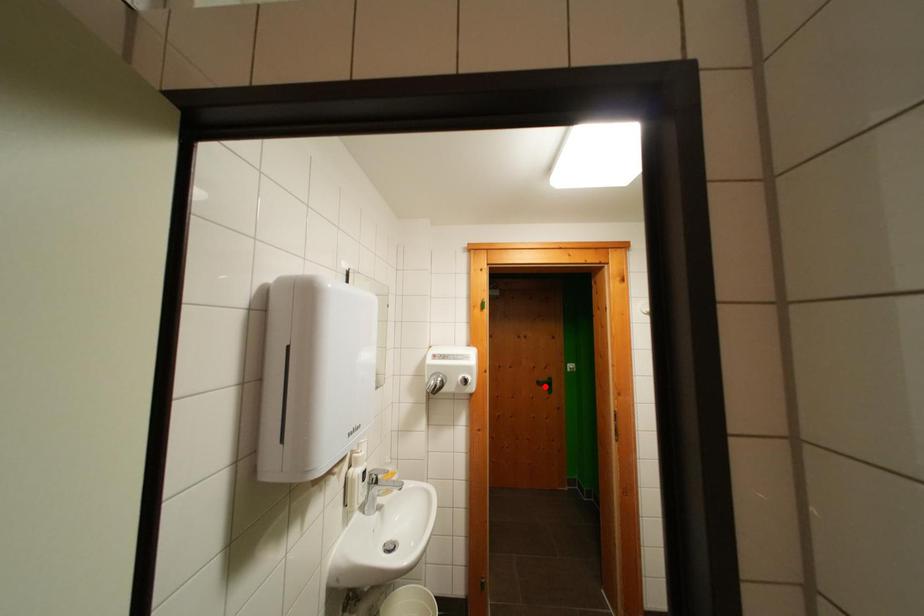
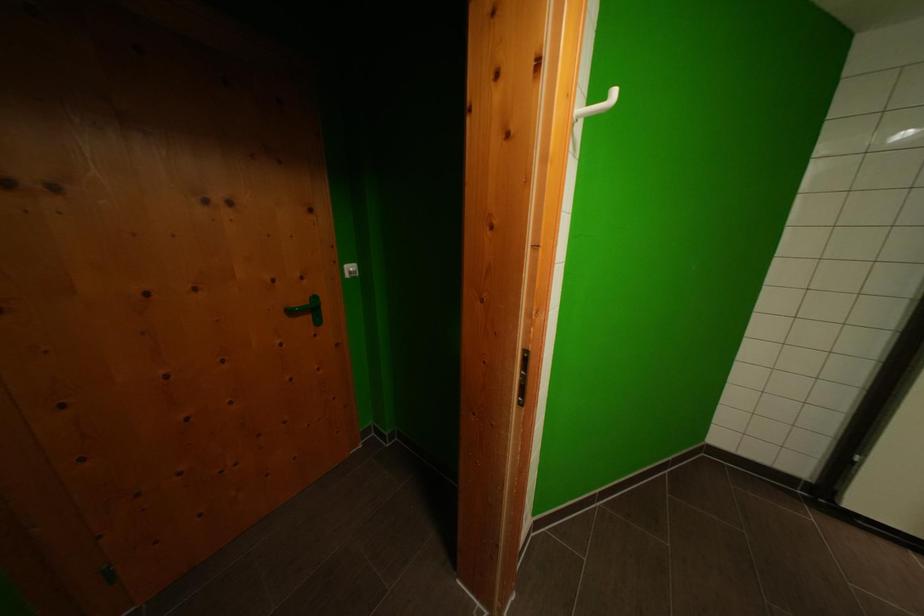
The point at the highlighted location is marked in the first image. Where is the corresponding point in the second image?

(297, 315)